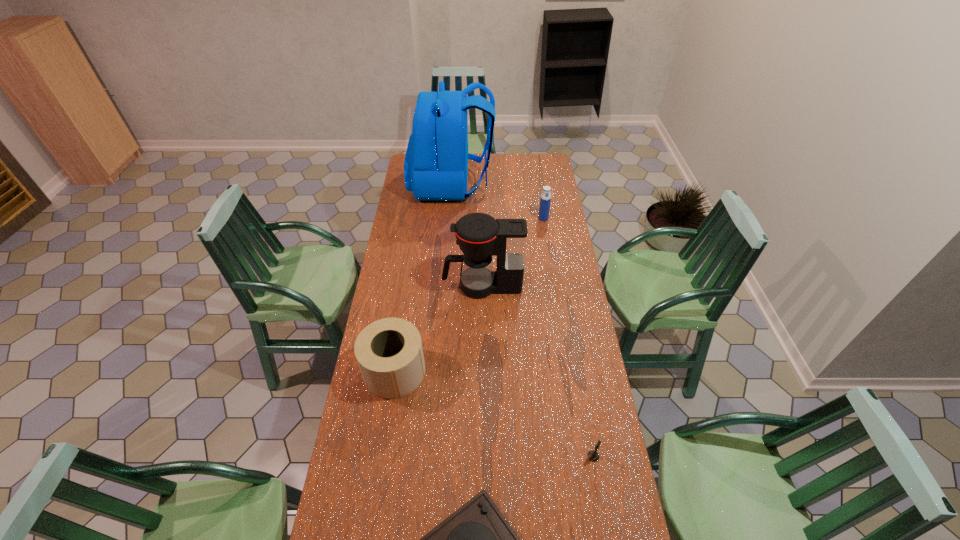
The image size is (960, 540). What are the coordinates of `vacant area in the image that satisfies the following two spatial constraints: 1. on the back of the tallest object; 2. on the back side of the second nearest object` in the screenshot? It's located at (431, 456).

I want to click on free point that satisfies the following two spatial constraints: 1. pour from the carafe of the fourth nearest object; 2. on the front side of the fourth farthest object, so click(482, 371).

In order to click on blank area in the image that satisfies the following two spatial constraints: 1. on the back of the farthest object; 2. on the back side of the fifth nearest object in this screenshot , I will do `click(449, 218)`.